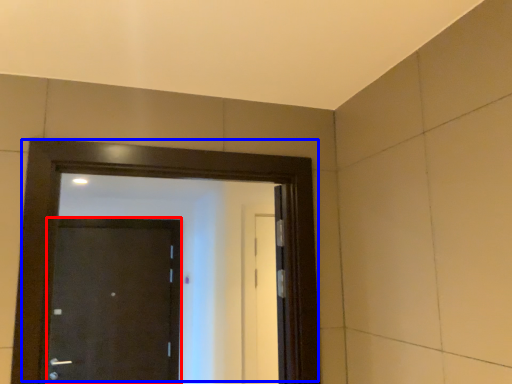
Question: Which object is further to the camera taking this photo, door (highlighted by a red box) or door (highlighted by a blue box)?

Choices:
 (A) door
 (B) door

Answer: (A)